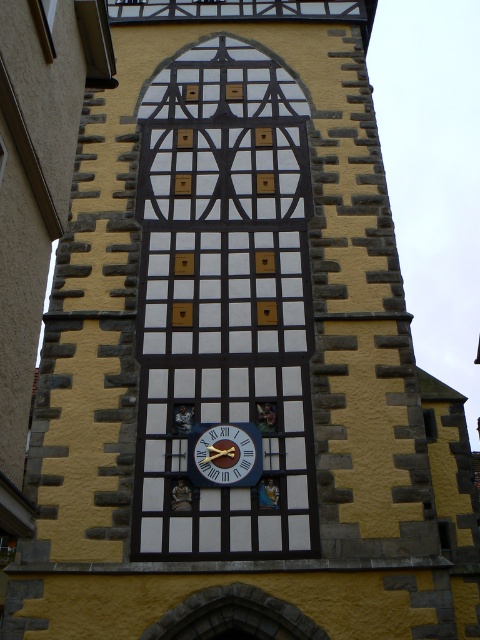
Question: Does white painted wood at center appear under blue painted wood clock at center?

Choices:
 (A) no
 (B) yes

Answer: (A)

Question: Which object is farther from the camera taking this photo?

Choices:
 (A) blue painted wood clock at center
 (B) white painted wood at center

Answer: (A)

Question: Which point is closer to the camera?

Choices:
 (A) (200, 467)
 (B) (215, 406)

Answer: (A)

Question: Does white painted wood at center have a larger size compared to blue painted wood clock at center?

Choices:
 (A) yes
 (B) no

Answer: (A)

Question: Can you confirm if white painted wood at center is bigger than blue painted wood clock at center?

Choices:
 (A) no
 (B) yes

Answer: (B)